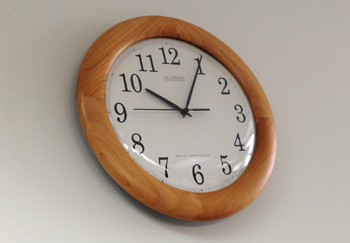
The image size is (350, 243). In order to click on wooden rim in this screenshot , I will do `click(249, 191)`.